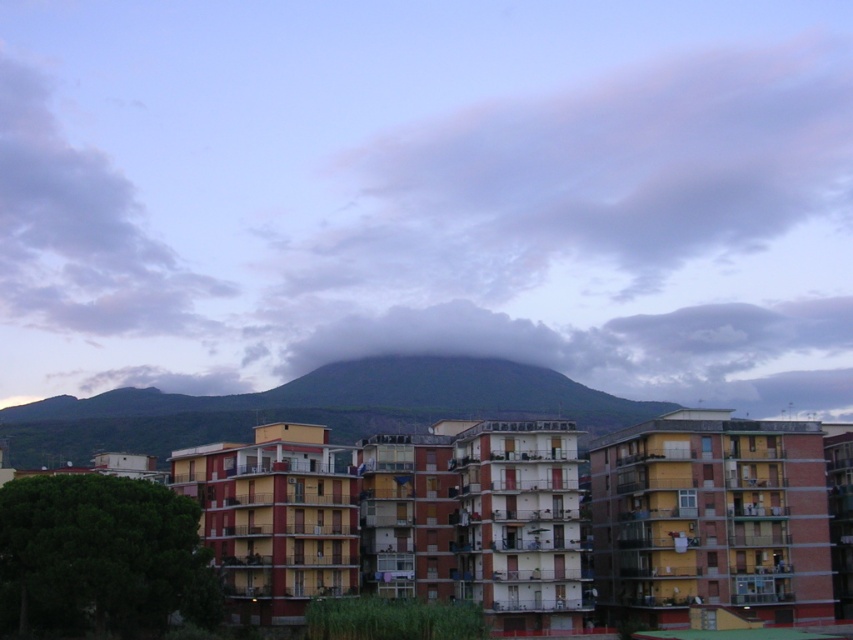
You are standing in the middle of the urban area looking at the cloudy sky at center and the dark green mountain at center. Which one appears taller from your viewpoint?

The cloudy sky at center appears taller than the dark green mountain at center from your viewpoint.

You are a drone operator who needs to fly a drone between the cloudy sky at center and the dark green mountain at center. The drone has a maximum flight distance of 50 meters. Can the drone safely fly between them without exceeding its range?

The cloudy sky at center and dark green mountain at center are 51.06 meters apart, which exceeds the drone maximum flight distance of 50 meters. The drone cannot safely fly between them without exceeding its range.

You are an urban planner analyzing the cityscape. The city wants to install a large billboard in the center of the image. Considering the cloudy sky at center and the dark green mountain at center, which one has a larger width in the scene?

The cloudy sky at center has a larger width than the dark green mountain at center according to the description.